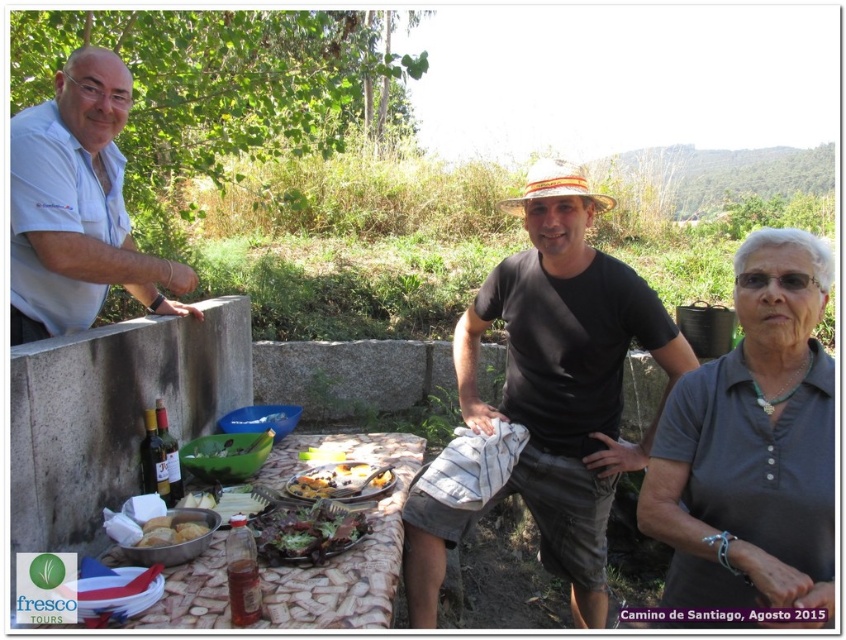
You are standing at the picnic table and want to throw a frisbee to a friend. You have two options for throwing directions, one towards point A at coordinates point (x=55, y=83) and another towards point B at coordinates point (x=157, y=528). Which point is closer to you so the frisbee won

Point (x=157, y=528) is closer to you because the description states that point (x=55, y=83) is behind point (x=157, y=528), meaning point (x=157, y=528) is in front and therefore closer.

In the scene shown: You are at a picnic table and want to place a 12 inch plate between the green leafy salad at center and the golden crusty bread at lower left. Can you fit it there?

The green leafy salad at center is wider than the golden crusty bread at lower left. Since the plate is 12 inches wide, it depends on the available space between them. However, the description only mentions their widths relative to each other, not the distance between them. Without knowing the exact distance, we cannot confirm if the plate will fit.